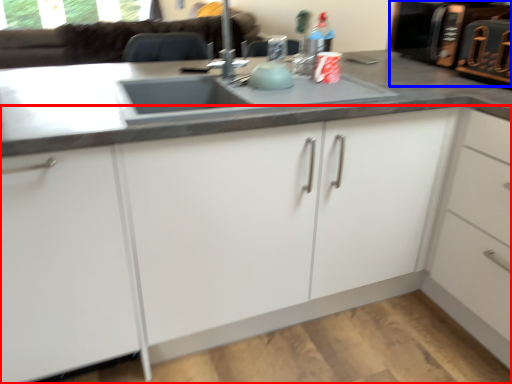
Question: Which object is closer to the camera taking this photo, cabinetry (highlighted by a red box) or appliance (highlighted by a blue box)?

Choices:
 (A) cabinetry
 (B) appliance

Answer: (A)